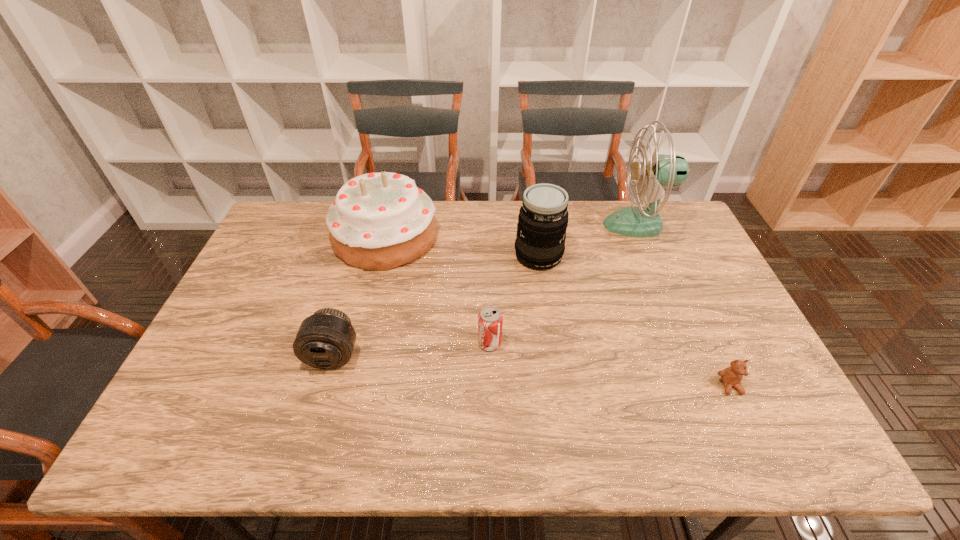
Where is `the tallest object`? This screenshot has height=540, width=960. the tallest object is located at coordinates (662, 170).

Locate an element on the screen. The image size is (960, 540). cake is located at coordinates (379, 221).

I want to click on the farther telephoto lens, so click(543, 217).

Locate an element on the screen. the third object from right to left is located at coordinates (543, 217).

The width and height of the screenshot is (960, 540). I want to click on the left telephoto lens, so click(325, 340).

At what (x,y) coordinates should I click in order to perform the action: click on the nearer telephoto lens. Please return your answer as a coordinate pair (x, y). This screenshot has height=540, width=960. Looking at the image, I should click on [x=325, y=340].

Find the location of `soda can`. soda can is located at coordinates (490, 319).

Identify the location of teddy bear. The image size is (960, 540). (731, 376).

Find the location of a particular element. the nearest object is located at coordinates (731, 376).

This screenshot has width=960, height=540. Find the location of `blank area located in front of the tallest object, directing airflow`. blank area located in front of the tallest object, directing airflow is located at coordinates (525, 225).